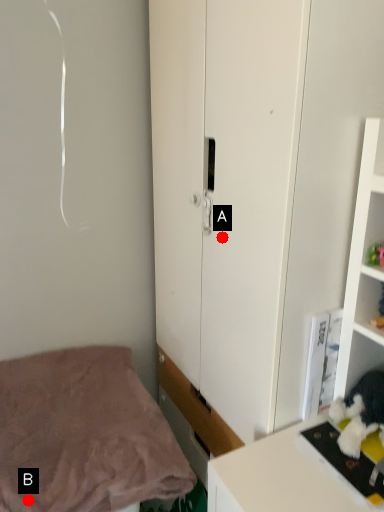
Question: Two points are circled on the image, labeled by A and B beside each circle. Which point is farther from the camera taking this photo?

Choices:
 (A) A is further
 (B) B is further

Answer: (A)